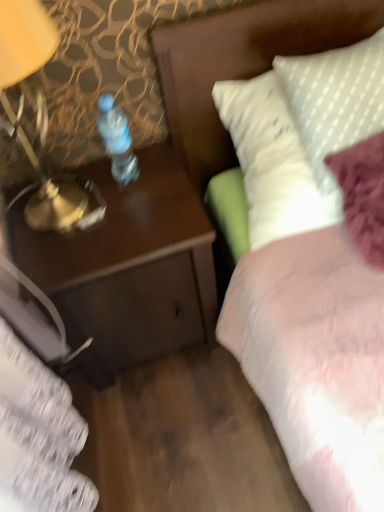
Question: Does clear plastic bottle at center come behind white dotted fabric at upper right?

Choices:
 (A) no
 (B) yes

Answer: (B)

Question: Can we say clear plastic bottle at center lies outside white dotted fabric at upper right?

Choices:
 (A) no
 (B) yes

Answer: (B)

Question: Is clear plastic bottle at center at the left side of white dotted fabric at upper right?

Choices:
 (A) yes
 (B) no

Answer: (A)

Question: Is clear plastic bottle at center taller than white dotted fabric at upper right?

Choices:
 (A) yes
 (B) no

Answer: (B)

Question: Considering the relative sizes of clear plastic bottle at center and white dotted fabric at upper right in the image provided, is clear plastic bottle at center shorter than white dotted fabric at upper right?

Choices:
 (A) yes
 (B) no

Answer: (A)

Question: From their relative heights in the image, would you say clear plastic bottle at center is taller or shorter than white dotted fabric at upper right?

Choices:
 (A) short
 (B) tall

Answer: (A)

Question: Is point click(x=105, y=143) positioned closer to the camera than point click(x=180, y=42)?

Choices:
 (A) farther
 (B) closer

Answer: (A)

Question: Looking at the image, does clear plastic bottle at center seem bigger or smaller compared to white dotted fabric at upper right?

Choices:
 (A) big
 (B) small

Answer: (B)

Question: Considering the positions of clear plastic bottle at center and white dotted fabric at upper right in the image, is clear plastic bottle at center wider or thinner than white dotted fabric at upper right?

Choices:
 (A) thin
 (B) wide

Answer: (A)

Question: Choose the correct answer: Is brown wood desk at left inside white dotted fabric at upper right or outside it?

Choices:
 (A) outside
 (B) inside

Answer: (A)

Question: Is point (11, 210) positioned closer to the camera than point (167, 35)?

Choices:
 (A) closer
 (B) farther

Answer: (B)

Question: In terms of height, does brown wood desk at left look taller or shorter compared to white dotted fabric at upper right?

Choices:
 (A) tall
 (B) short

Answer: (A)

Question: Is brown wood desk at left bigger or smaller than white dotted fabric at upper right?

Choices:
 (A) small
 (B) big

Answer: (B)

Question: From the image's perspective, is brown wood desk at left positioned above or below clear plastic bottle at center?

Choices:
 (A) above
 (B) below

Answer: (B)

Question: Is brown wood desk at left bigger or smaller than clear plastic bottle at center?

Choices:
 (A) big
 (B) small

Answer: (A)